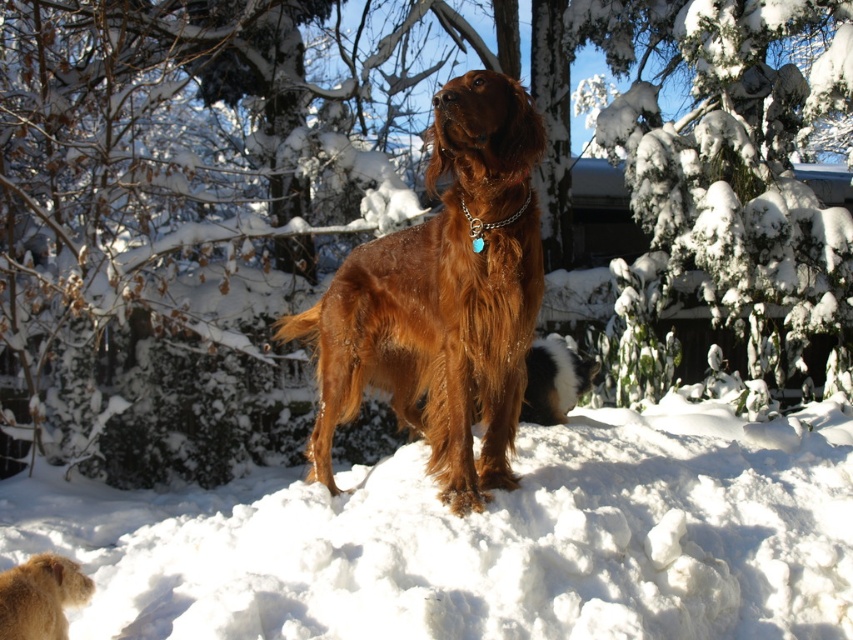
Between point (778, 291) and point (535, 349), which one is positioned in front?

Point (535, 349) is in front.

Does green textured pine tree at upper right have a lesser height compared to black and white fur at center?

In fact, green textured pine tree at upper right may be taller than black and white fur at center.

This screenshot has height=640, width=853. Find the location of `green textured pine tree at upper right`. green textured pine tree at upper right is located at coordinates (730, 172).

Identify the location of green textured pine tree at upper right. pos(730,172).

Which of these two, green textured pine tree at upper right or brown furry dog at center, stands taller?

green textured pine tree at upper right

Is green textured pine tree at upper right to the right of brown furry dog at center from the viewer's perspective?

Indeed, green textured pine tree at upper right is positioned on the right side of brown furry dog at center.

What do you see at coordinates (730, 172) in the screenshot? I see `green textured pine tree at upper right` at bounding box center [730, 172].

Identify the location of green textured pine tree at upper right. Image resolution: width=853 pixels, height=640 pixels. (730, 172).

Who is more forward, (544, 518) or (575, 365)?

Point (544, 518)

Between white fluffy snow at center and black and white fur at center, which one is positioned higher?

black and white fur at center

The image size is (853, 640). What do you see at coordinates (485, 540) in the screenshot?
I see `white fluffy snow at center` at bounding box center [485, 540].

I want to click on white fluffy snow at center, so click(x=485, y=540).